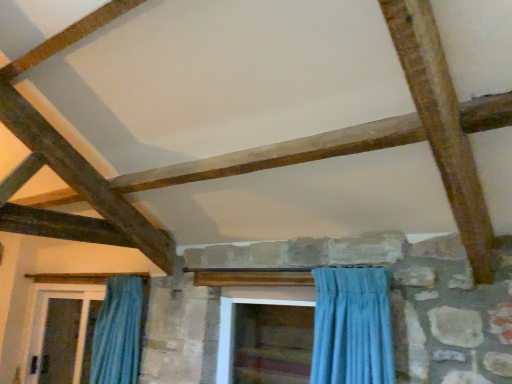
What do you see at coordinates (232, 331) in the screenshot? This screenshot has width=512, height=384. I see `wooden screen door at center, the 1th screen door when ordered from right to left` at bounding box center [232, 331].

Where is `clear glass screen door at lower left, which ranks as the 1th screen door in left-to-right order`? The height and width of the screenshot is (384, 512). clear glass screen door at lower left, which ranks as the 1th screen door in left-to-right order is located at coordinates (59, 336).

Which is behind, blue fabric curtain at left or wooden screen door at center, marked as the 2th screen door in a left-to-right arrangement?

blue fabric curtain at left is further from the camera.

From a real-world perspective, which is physically above, blue fabric curtain at left or wooden screen door at center, the 1th screen door when ordered from right to left?

In real-world perspective, wooden screen door at center, the 1th screen door when ordered from right to left, is above.

The height and width of the screenshot is (384, 512). I want to click on curtain on the left of wooden screen door at center, marked as the first screen door in a front-to-back arrangement, so click(x=118, y=333).

Is blue fabric curtain at left oriented away from wooden screen door at center, the 1th screen door when ordered from right to left?

blue fabric curtain at left does not have its back to wooden screen door at center, the 1th screen door when ordered from right to left.

Considering the relative sizes of blue fabric curtain at left and clear glass screen door at lower left, which ranks as the 1th screen door in left-to-right order, in the image provided, is blue fabric curtain at left smaller than clear glass screen door at lower left, which ranks as the 1th screen door in left-to-right order,?

Yes, blue fabric curtain at left is smaller than clear glass screen door at lower left, which ranks as the 1th screen door in left-to-right order.

Is blue fabric curtain at left facing away from clear glass screen door at lower left, arranged as the second screen door when viewed from the front?

No, clear glass screen door at lower left, arranged as the second screen door when viewed from the front, is not at the back of blue fabric curtain at left.

From the image's perspective, which is above, blue fabric curtain at left or clear glass screen door at lower left, marked as the second screen door in a right-to-left arrangement?

blue fabric curtain at left appears higher in the image.

From a real-world perspective, is wooden screen door at center, the 1th screen door when ordered from right to left, under clear glass screen door at lower left, positioned as the first screen door in back-to-front order?

Actually, wooden screen door at center, the 1th screen door when ordered from right to left, is physically above clear glass screen door at lower left, positioned as the first screen door in back-to-front order, in the real world.

How much distance is there between wooden screen door at center, marked as the 2th screen door in a left-to-right arrangement, and clear glass screen door at lower left, which ranks as the 1th screen door in left-to-right order?

wooden screen door at center, marked as the 2th screen door in a left-to-right arrangement, is 6.96 feet away from clear glass screen door at lower left, which ranks as the 1th screen door in left-to-right order.

Is wooden screen door at center, marked as the 2th screen door in a left-to-right arrangement, touching clear glass screen door at lower left, marked as the second screen door in a right-to-left arrangement?

wooden screen door at center, marked as the 2th screen door in a left-to-right arrangement, and clear glass screen door at lower left, marked as the second screen door in a right-to-left arrangement, are clearly separated.

Is clear glass screen door at lower left, positioned as the first screen door in back-to-front order, facing away from wooden screen door at center, the 1th screen door when ordered from right to left?

That's not correct — clear glass screen door at lower left, positioned as the first screen door in back-to-front order, is not looking away from wooden screen door at center, the 1th screen door when ordered from right to left.

Does clear glass screen door at lower left, marked as the second screen door in a right-to-left arrangement, have a smaller size compared to wooden screen door at center, marked as the first screen door in a front-to-back arrangement?

Actually, clear glass screen door at lower left, marked as the second screen door in a right-to-left arrangement, might be larger than wooden screen door at center, marked as the first screen door in a front-to-back arrangement.

Looking at this image, would you say clear glass screen door at lower left, which ranks as the 1th screen door in left-to-right order, is inside or outside wooden screen door at center, marked as the first screen door in a front-to-back arrangement?

clear glass screen door at lower left, which ranks as the 1th screen door in left-to-right order, is not inside wooden screen door at center, marked as the first screen door in a front-to-back arrangement, it's outside.

Locate an element on the screen. screen door on the right of clear glass screen door at lower left, positioned as the first screen door in back-to-front order is located at coordinates (232, 331).

From the image's perspective, which is below, clear glass screen door at lower left, which ranks as the 1th screen door in left-to-right order, or blue fabric curtain at left?

From the image's view, clear glass screen door at lower left, which ranks as the 1th screen door in left-to-right order, is below.

Does point (71, 333) come closer to viewer compared to point (104, 311)?

No, (71, 333) is behind (104, 311).

Are clear glass screen door at lower left, arranged as the second screen door when viewed from the front, and blue fabric curtain at left making contact?

clear glass screen door at lower left, arranged as the second screen door when viewed from the front, and blue fabric curtain at left are not in contact.

Does clear glass screen door at lower left, which ranks as the 1th screen door in left-to-right order, contain blue fabric curtain at left?

No, blue fabric curtain at left is not surrounded by clear glass screen door at lower left, which ranks as the 1th screen door in left-to-right order.

Looking at this image, which object is thinner, wooden screen door at center, the 1th screen door when ordered from right to left, or blue fabric curtain at left?

With smaller width is blue fabric curtain at left.

Is wooden screen door at center, marked as the first screen door in a front-to-back arrangement, behind blue fabric curtain at left?

That is False.

Considering the sizes of objects wooden screen door at center, the 1th screen door when ordered from right to left, and blue fabric curtain at left in the image provided, who is bigger, wooden screen door at center, the 1th screen door when ordered from right to left, or blue fabric curtain at left?

blue fabric curtain at left.

Considering the relative positions of wooden screen door at center, marked as the first screen door in a front-to-back arrangement, and blue fabric curtain at left in the image provided, is wooden screen door at center, marked as the first screen door in a front-to-back arrangement, to the left of blue fabric curtain at left from the viewer's perspective?

No.

You are a GUI agent. You are given a task and a screenshot of the screen. Output one action in this format:
    pyautogui.click(x=<x>, y=<y>)
    Task: Click on the curtain below the wooden screen door at center, the 2th screen door when ordered from back to front (from the image's perspective)
    This screenshot has width=512, height=384.
    Given the screenshot: What is the action you would take?
    pyautogui.click(x=118, y=333)

Where is `screen door below the blue fabric curtain at left (from a real-world perspective)`? This screenshot has height=384, width=512. screen door below the blue fabric curtain at left (from a real-world perspective) is located at coordinates (59, 336).

Based on their spatial positions, is wooden screen door at center, the 2th screen door when ordered from back to front, or blue fabric curtain at left closer to clear glass screen door at lower left, positioned as the first screen door in back-to-front order?

Based on the image, blue fabric curtain at left appears to be nearer to clear glass screen door at lower left, positioned as the first screen door in back-to-front order.

Based on their spatial positions, is clear glass screen door at lower left, which ranks as the 1th screen door in left-to-right order, or blue fabric curtain at left further from wooden screen door at center, marked as the 2th screen door in a left-to-right arrangement?

Among the two, clear glass screen door at lower left, which ranks as the 1th screen door in left-to-right order, is located further to wooden screen door at center, marked as the 2th screen door in a left-to-right arrangement.

Looking at the image, which one is located closer to wooden screen door at center, the 1th screen door when ordered from right to left, blue fabric curtain at left or clear glass screen door at lower left, marked as the second screen door in a right-to-left arrangement?

blue fabric curtain at left is positioned closer to the anchor wooden screen door at center, the 1th screen door when ordered from right to left.

When comparing their distances from blue fabric curtain at left, does wooden screen door at center, marked as the first screen door in a front-to-back arrangement, or clear glass screen door at lower left, which ranks as the 1th screen door in left-to-right order, seem further?

Based on the image, clear glass screen door at lower left, which ranks as the 1th screen door in left-to-right order, appears to be further to blue fabric curtain at left.

Considering their positions, is clear glass screen door at lower left, positioned as the first screen door in back-to-front order, positioned closer to blue fabric curtain at left than wooden screen door at center, marked as the 2th screen door in a left-to-right arrangement?

The object closer to blue fabric curtain at left is wooden screen door at center, marked as the 2th screen door in a left-to-right arrangement.

Considering their positions, is blue fabric curtain at left positioned further to clear glass screen door at lower left, which ranks as the 1th screen door in left-to-right order, than wooden screen door at center, the 2th screen door when ordered from back to front?

Based on the image, wooden screen door at center, the 2th screen door when ordered from back to front, appears to be further to clear glass screen door at lower left, which ranks as the 1th screen door in left-to-right order.

The width and height of the screenshot is (512, 384). What are the coordinates of `curtain between clear glass screen door at lower left, arranged as the second screen door when viewed from the front, and wooden screen door at center, the 1th screen door when ordered from right to left, from left to right` in the screenshot? It's located at (118, 333).